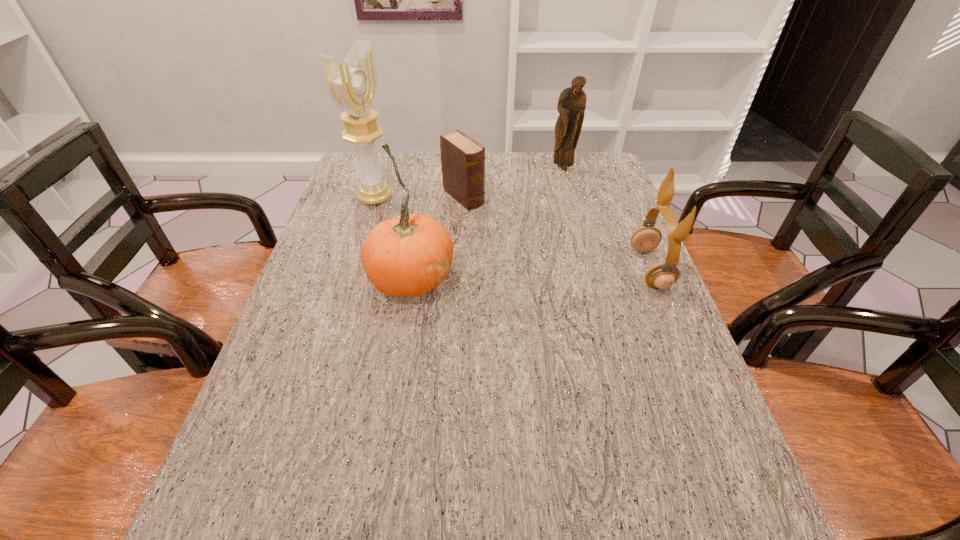
At what (x,y) coordinates should I click in order to perform the action: click on vacant space located 0.260m on the front-facing side of the award. Please return your answer as a coordinate pair (x, y). The height and width of the screenshot is (540, 960). Looking at the image, I should click on (459, 233).

Where is `free space located 0.070m on the spine side of the shortest object`? The height and width of the screenshot is (540, 960). free space located 0.070m on the spine side of the shortest object is located at coordinates (490, 219).

The width and height of the screenshot is (960, 540). I want to click on vacant region located 0.230m on the spine side of the shortest object, so click(523, 248).

Where is `free space located 0.220m on the spine side of the shortest object`? The image size is (960, 540). free space located 0.220m on the spine side of the shortest object is located at coordinates (521, 246).

At what (x,y) coordinates should I click in order to perform the action: click on free location located on the front-facing side of the farthest object. Please return your answer as a coordinate pair (x, y). The image size is (960, 540). Looking at the image, I should click on (528, 245).

The image size is (960, 540). Identify the location of vacant space situated on the front-facing side of the farthest object. (533, 234).

This screenshot has height=540, width=960. I want to click on free space located 0.220m on the front-facing side of the farthest object, so click(544, 209).

Where is `award that is positioned at the far edge`? award that is positioned at the far edge is located at coordinates (352, 85).

You are a GUI agent. You are given a task and a screenshot of the screen. Output one action in this format:
    pyautogui.click(x=<x>, y=<y>)
    Task: Click on the diary at the far edge
    The height and width of the screenshot is (540, 960).
    Given the screenshot: What is the action you would take?
    pyautogui.click(x=462, y=159)

At what (x,y) coordinates should I click in order to perform the action: click on figurine that is at the far edge. Please return your answer as a coordinate pair (x, y). Looking at the image, I should click on (571, 105).